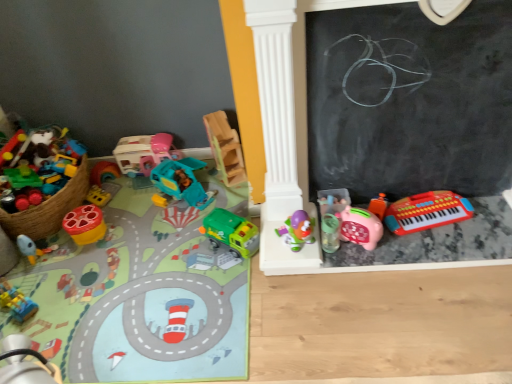
Image resolution: width=512 pixels, height=384 pixels. Identify the location of vacant space to the left of teal plastic car at center, positioned as the sixth toy in left-to-right order. (133, 203).